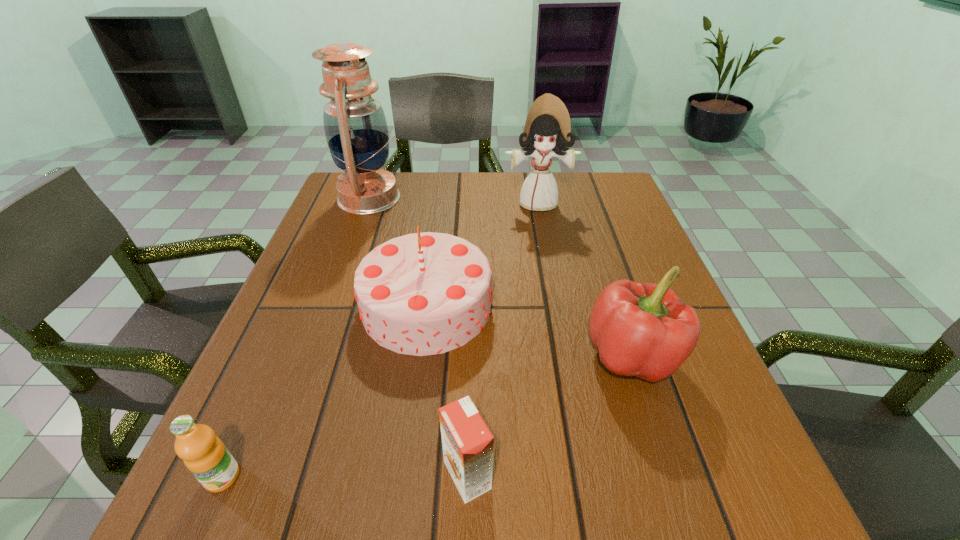
Identify the location of free space located on the left of the right orange juice. (400, 475).

Locate an element on the screen. The height and width of the screenshot is (540, 960). oil lamp that is at the far edge is located at coordinates (356, 131).

The height and width of the screenshot is (540, 960). Identify the location of doll located in the far edge section of the desktop. (547, 126).

Identify the location of oil lamp located at the left edge. (356, 131).

This screenshot has width=960, height=540. What are the coordinates of `birthday cake that is at the left edge` in the screenshot? It's located at (420, 294).

Locate an element on the screen. orange juice located at the left edge is located at coordinates [x=204, y=454].

The width and height of the screenshot is (960, 540). I want to click on doll that is at the right edge, so click(x=547, y=126).

Find the location of a particular element. This screenshot has width=960, height=540. bell pepper that is at the right edge is located at coordinates (645, 330).

In order to click on object that is at the far left corner in this screenshot , I will do `click(356, 131)`.

At what (x,y) coordinates should I click in order to perform the action: click on object that is at the near left corner. Please return your answer as a coordinate pair (x, y). The image size is (960, 540). Looking at the image, I should click on (204, 454).